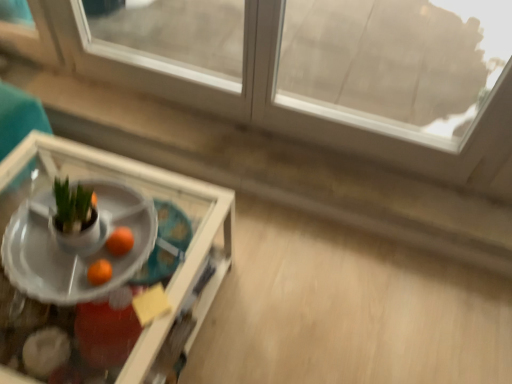
What do you see at coordinates (120, 241) in the screenshot? This screenshot has width=512, height=384. I see `orange matte at center` at bounding box center [120, 241].

This screenshot has width=512, height=384. What do you see at coordinates (144, 195) in the screenshot? I see `clear glass tray at lower left, which is the 1th table in front-to-back order` at bounding box center [144, 195].

You are a GUI agent. You are given a task and a screenshot of the screen. Output one action in this format:
    pyautogui.click(x=<x>, y=<y>)
    Task: Click on the orange matte at center
    
    Given the screenshot: What is the action you would take?
    pyautogui.click(x=120, y=241)

Is clear glass tray at lower left, which is the 1th table in front-to-back order, bigger or smaller than transparent glass window at upper center?

In the image, clear glass tray at lower left, which is the 1th table in front-to-back order, appears to be larger than transparent glass window at upper center.

Starting from the transparent glass window at upper center, which table is the 2nd one in front? Please provide its 2D coordinates.

[(144, 195)]

Considering the points (177, 281) and (192, 70), which point is in front, point (177, 281) or point (192, 70)?

Positioned in front is point (177, 281).

In the scene shown: In terms of width, does clear glass tray at lower left, the second table from the back, look wider or thinner when compared to transparent glass window at upper center?

In the image, clear glass tray at lower left, the second table from the back, appears to be wider than transparent glass window at upper center.

Considering the sizes of transparent glass window at upper center and clear glass tray at lower left, the second table from the back, in the image, is transparent glass window at upper center wider or thinner than clear glass tray at lower left, the second table from the back,?

In the image, transparent glass window at upper center appears to be more narrow than clear glass tray at lower left, the second table from the back.

Which point is more forward, (109,70) or (7,199)?

→ Positioned in front is point (7,199).

From the image's perspective, is transparent glass window at upper center positioned above or below clear glass tray at lower left, which is the 1th table in front-to-back order?

transparent glass window at upper center is situated higher than clear glass tray at lower left, which is the 1th table in front-to-back order, in the image.

Is transparent glass window at upper center to the right of clear glass tray at lower left, the second table from the back, from the viewer's perspective?

Yes, transparent glass window at upper center is to the right of clear glass tray at lower left, the second table from the back.

Is clear glass tray at lower left, the second table from the back, further to camera compared to white glossy tray at center, which is the first table from back to front?

No.

Which of these two, clear glass tray at lower left, which is the 1th table in front-to-back order, or white glossy tray at center, which is the first table from back to front, stands taller?

With more height is clear glass tray at lower left, which is the 1th table in front-to-back order.

Visually, is clear glass tray at lower left, the second table from the back, positioned to the left or to the right of white glossy tray at center, which is the first table from back to front?

Based on their positions, clear glass tray at lower left, the second table from the back, is located to the left of white glossy tray at center, which is the first table from back to front.

From a real-world perspective, is clear glass tray at lower left, the second table from the back, physically located above or below white glossy tray at center, which is counted as the second table, starting from the front?

Clearly, from a real-world perspective, clear glass tray at lower left, the second table from the back, is below white glossy tray at center, which is counted as the second table, starting from the front.

Is orange matte at center surrounded by clear glass tray at lower left, which is the 1th table in front-to-back order?

Definitely not — orange matte at center is not inside clear glass tray at lower left, which is the 1th table in front-to-back order.

Who is taller, clear glass tray at lower left, which is the 1th table in front-to-back order, or orange matte at center?

clear glass tray at lower left, which is the 1th table in front-to-back order, is taller.

Could you tell me if clear glass tray at lower left, the second table from the back, is facing orange matte at center?

No, clear glass tray at lower left, the second table from the back, is not aimed at orange matte at center.

Considering the sizes of clear glass tray at lower left, the second table from the back, and orange matte at center in the image, is clear glass tray at lower left, the second table from the back, bigger or smaller than orange matte at center?

clear glass tray at lower left, the second table from the back, is bigger than orange matte at center.

From the image's perspective, who appears lower, orange matte at center or clear glass tray at lower left, the second table from the back?

From the image's view, clear glass tray at lower left, the second table from the back, is below.

Which is more to the right, orange matte at center or clear glass tray at lower left, which is the 1th table in front-to-back order?

Positioned to the right is orange matte at center.

Relative to clear glass tray at lower left, the second table from the back, is orange matte at center in front or behind?

Clearly, orange matte at center is behind clear glass tray at lower left, the second table from the back.

Does orange matte at center have a lesser height compared to clear glass tray at lower left, which is the 1th table in front-to-back order?

Yes.

Is point (344, 129) positioned after point (116, 237)?

That is True.

Based on their sizes in the image, would you say transparent glass window at upper center is bigger or smaller than orange matte at center?

Clearly, transparent glass window at upper center is larger in size than orange matte at center.

Who is more distant, transparent glass window at upper center or orange matte at center?

orange matte at center is more distant.

From the image's perspective, is transparent glass window at upper center over orange matte at center?

Yes.

Can you confirm if transparent glass window at upper center is wider than white glossy tray at center, which is the first table from back to front?

No.

Can you see transparent glass window at upper center touching white glossy tray at center, which is counted as the second table, starting from the front?

No, transparent glass window at upper center is not next to white glossy tray at center, which is counted as the second table, starting from the front.

From the image's perspective, would you say transparent glass window at upper center is shown under white glossy tray at center, which is counted as the second table, starting from the front?

Actually, transparent glass window at upper center appears above white glossy tray at center, which is counted as the second table, starting from the front, in the image.

Can you confirm if transparent glass window at upper center is smaller than white glossy tray at center, which is counted as the second table, starting from the front?

Actually, transparent glass window at upper center might be larger than white glossy tray at center, which is counted as the second table, starting from the front.

From the image's perspective, starting from the transparent glass window at upper center, which table is the 2nd one below? Please provide its 2D coordinates.

[(144, 195)]

I want to click on the 2nd table in front of the transparent glass window at upper center, counting from the anchor's position, so click(x=144, y=195).

Which object lies further to the anchor point clear glass tray at lower left, the second table from the back, white glossy tray at center, which is the first table from back to front, or orange matte at center?

Among the two, orange matte at center is located further to clear glass tray at lower left, the second table from the back.

Which object lies further to the anchor point white glossy tray at center, which is the first table from back to front, transparent glass window at upper center or clear glass tray at lower left, which is the 1th table in front-to-back order?

transparent glass window at upper center lies further to white glossy tray at center, which is the first table from back to front, than the other object.

Estimate the real-world distances between objects in this image. Which object is closer to orange matte at center, white glossy tray at center, which is the first table from back to front, or transparent glass window at upper center?

Based on the image, white glossy tray at center, which is the first table from back to front, appears to be nearer to orange matte at center.

Which object lies nearer to the anchor point clear glass tray at lower left, which is the 1th table in front-to-back order, transparent glass window at upper center or white glossy tray at center, which is the first table from back to front?

white glossy tray at center, which is the first table from back to front, is closer to clear glass tray at lower left, which is the 1th table in front-to-back order.

Estimate the real-world distances between objects in this image. Which object is further from clear glass tray at lower left, which is the 1th table in front-to-back order, transparent glass window at upper center or orange matte at center?

transparent glass window at upper center is further to clear glass tray at lower left, which is the 1th table in front-to-back order.

Estimate the real-world distances between objects in this image. Which object is closer to orange matte at center, clear glass tray at lower left, which is the 1th table in front-to-back order, or transparent glass window at upper center?

clear glass tray at lower left, which is the 1th table in front-to-back order, lies closer to orange matte at center than the other object.

When comparing their distances from white glossy tray at center, which is counted as the second table, starting from the front, does clear glass tray at lower left, which is the 1th table in front-to-back order, or transparent glass window at upper center seem closer?

Based on the image, clear glass tray at lower left, which is the 1th table in front-to-back order, appears to be nearer to white glossy tray at center, which is counted as the second table, starting from the front.

Looking at the image, which one is located further to transparent glass window at upper center, clear glass tray at lower left, the second table from the back, or orange matte at center?

Among the two, orange matte at center is located further to transparent glass window at upper center.

At what (x,y) coordinates should I click in order to perform the action: click on orange between transparent glass window at upper center and clear glass tray at lower left, which is the 1th table in front-to-back order, in the up-down direction. Please return your answer as a coordinate pair (x, y). This screenshot has height=384, width=512. Looking at the image, I should click on (120, 241).

You are a GUI agent. You are given a task and a screenshot of the screen. Output one action in this format:
    pyautogui.click(x=<x>, y=<y>)
    Task: Click on the table between transparent glass window at upper center and orange matte at center from top to bottom
    The height and width of the screenshot is (384, 512).
    Given the screenshot: What is the action you would take?
    pyautogui.click(x=75, y=247)

The image size is (512, 384). I want to click on table that lies between transparent glass window at upper center and clear glass tray at lower left, the second table from the back, from top to bottom, so click(x=75, y=247).

What are the coordinates of `table between clear glass tray at lower left, the second table from the back, and orange matte at center from front to back` in the screenshot? It's located at (75, 247).